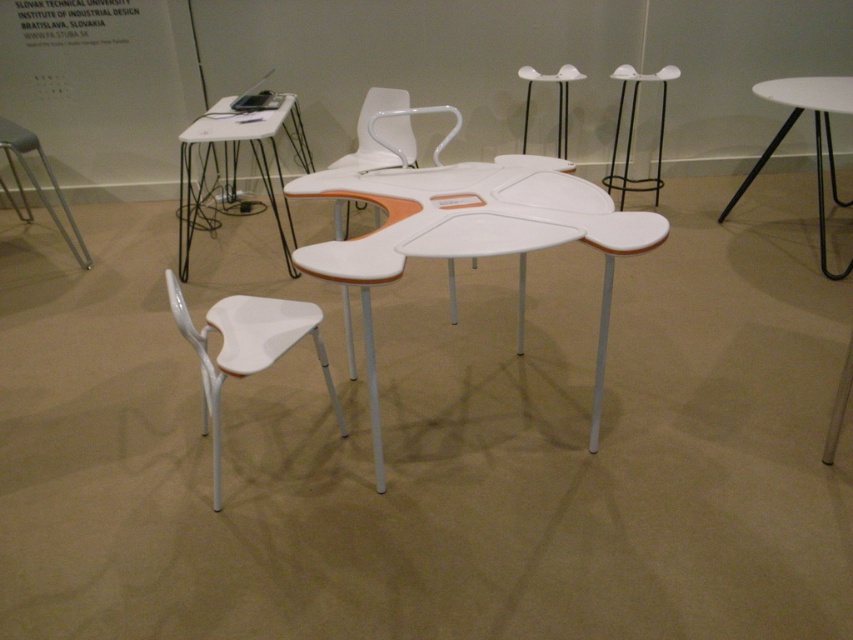
Can you confirm if white glossy table at upper left is positioned to the right of white plastic chair at lower left?

In fact, white glossy table at upper left is to the left of white plastic chair at lower left.

Can you confirm if white glossy table at upper left is thinner than white plastic chair at lower left?

No.

Image resolution: width=853 pixels, height=640 pixels. Describe the element at coordinates (236, 170) in the screenshot. I see `white glossy table at upper left` at that location.

In order to click on white glossy table at upper left in this screenshot , I will do `click(236, 170)`.

Who is lower down, white matte chair at center or black metal stool at upper right?

Positioned lower is white matte chair at center.

Can you confirm if white matte chair at center is positioned below black metal stool at upper right?

Yes, white matte chair at center is below black metal stool at upper right.

Find the location of `white matte chair at center`. white matte chair at center is located at coordinates (381, 132).

Consider the image. Does white glossy table at upper right have a lesser width compared to metallic silver stool at left?

No, white glossy table at upper right is not thinner than metallic silver stool at left.

Describe the element at coordinates (814, 138) in the screenshot. I see `white glossy table at upper right` at that location.

Where is `white glossy table at upper right`? white glossy table at upper right is located at coordinates (814, 138).